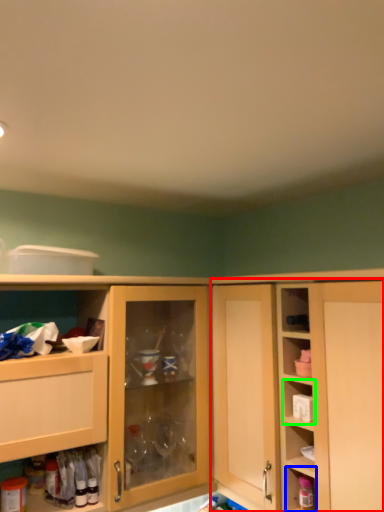
Question: Based on their relative distances, which object is farther from cabinetry (highlighted by a red box)? Choose from cabinet (highlighted by a blue box) and shelf (highlighted by a green box).

Choices:
 (A) cabinet
 (B) shelf

Answer: (A)